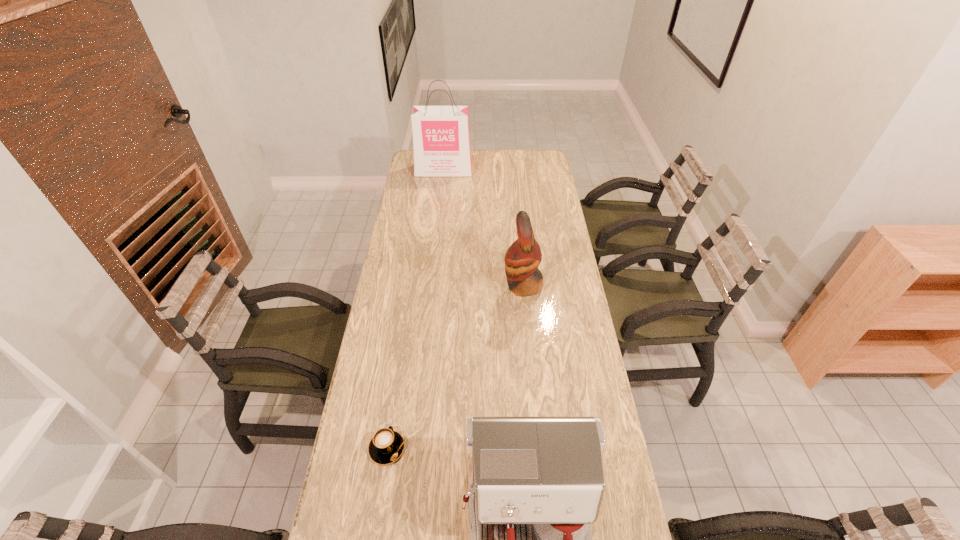
Where is `shopping bag positioned at the left edge`? This screenshot has width=960, height=540. shopping bag positioned at the left edge is located at coordinates (x=441, y=143).

Where is `cappuccino present at the left edge`? cappuccino present at the left edge is located at coordinates (387, 445).

This screenshot has width=960, height=540. Find the location of `object that is positioned at the right edge`. object that is positioned at the right edge is located at coordinates (523, 257).

This screenshot has height=540, width=960. What are the coordinates of `object located in the far left corner section of the desktop` in the screenshot? It's located at (441, 143).

Where is `vacant area at the far edge of the desktop`? The image size is (960, 540). vacant area at the far edge of the desktop is located at coordinates point(476,159).

I want to click on vacant point at the left edge, so click(x=416, y=211).

Where is `blank space at the right edge of the desktop`? Image resolution: width=960 pixels, height=540 pixels. blank space at the right edge of the desktop is located at coordinates (577, 278).

The height and width of the screenshot is (540, 960). What are the coordinates of `empty space between the parrot and the farthest object` in the screenshot? It's located at (483, 228).

The height and width of the screenshot is (540, 960). I want to click on free space between the shortest object and the tallest object, so click(416, 309).

At what (x,y) coordinates should I click in order to perform the action: click on unoccupied area between the cappuccino and the second farthest object. Please return your answer as a coordinate pair (x, y). Looking at the image, I should click on (455, 367).